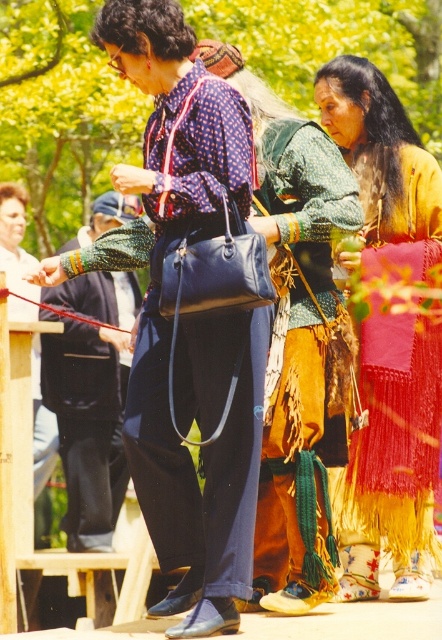
Between knitted wool skirt at center and green woven fabric at center, which one has less height?

With less height is knitted wool skirt at center.

Is knitted wool skirt at center to the right of green woven fabric at center from the viewer's perspective?

Yes, knitted wool skirt at center is to the right of green woven fabric at center.

What do you see at coordinates (392, 456) in the screenshot? This screenshot has width=442, height=640. I see `knitted wool skirt at center` at bounding box center [392, 456].

This screenshot has width=442, height=640. I want to click on knitted wool skirt at center, so click(392, 456).

Does knitted wool skirt at center lie in front of textured brown leather vest at center?

No, it is not.

Does knitted wool skirt at center have a larger size compared to textured brown leather vest at center?

Actually, knitted wool skirt at center might be smaller than textured brown leather vest at center.

Who is more forward, (x=397, y=561) or (x=346, y=400)?

Positioned in front is point (x=346, y=400).

What are the coordinates of `knitted wool skirt at center` in the screenshot? It's located at (392, 456).

Is textured brown leather vest at center wider than green woven fabric at center?

In fact, textured brown leather vest at center might be narrower than green woven fabric at center.

How distant is textured brown leather vest at center from green woven fabric at center?

textured brown leather vest at center is 6.63 meters away from green woven fabric at center.

Describe the element at coordinates (303, 362) in the screenshot. I see `textured brown leather vest at center` at that location.

The width and height of the screenshot is (442, 640). Find the location of `textured brown leather vest at center`. textured brown leather vest at center is located at coordinates (303, 362).